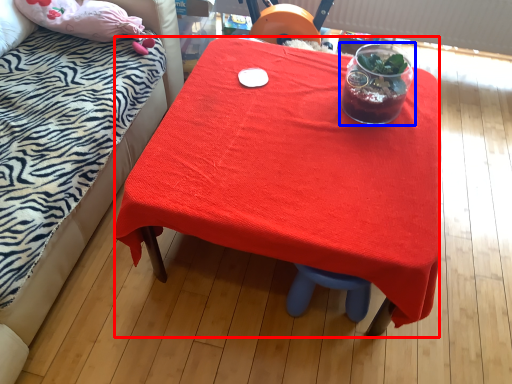
Question: Which point is closer to the camera, desk (highlighted by a red box) or tableware (highlighted by a blue box)?

Choices:
 (A) desk
 (B) tableware

Answer: (A)